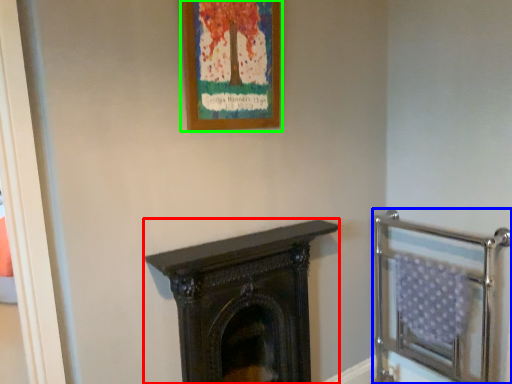
Question: Considering the real-world distances, which object is closest to fireplace (highlighted by a red box)? balustrade (highlighted by a blue box) or picture frame (highlighted by a green box).

Choices:
 (A) balustrade
 (B) picture frame

Answer: (A)